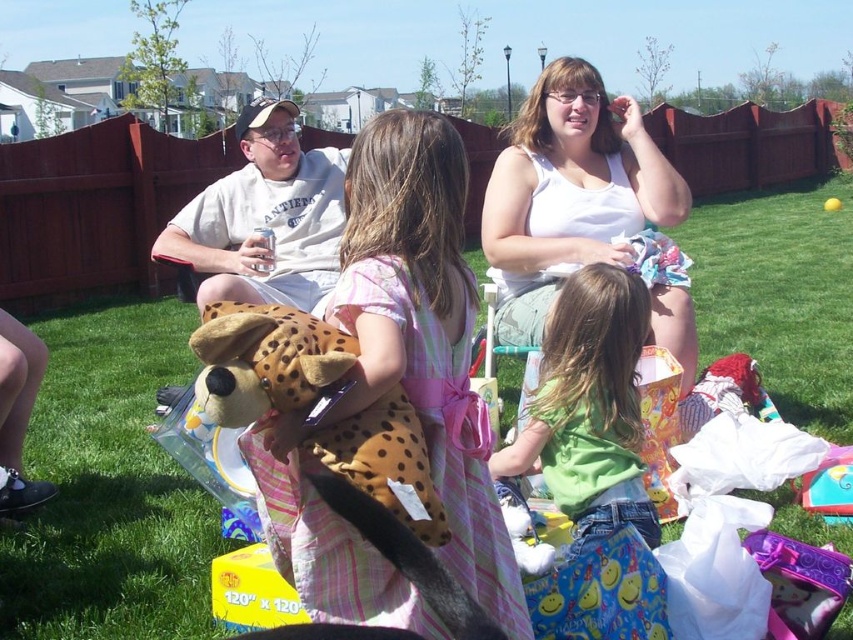
The height and width of the screenshot is (640, 853). What are the coordinates of `soft pink dress at center` in the screenshot? It's located at (424, 332).

Between soft pink dress at center and green cotton shirt at center, which one appears on the right side from the viewer's perspective?

Positioned to the right is green cotton shirt at center.

Between point (364, 576) and point (543, 365), which one is positioned behind?

The point (543, 365) is more distant.

You are a GUI agent. You are given a task and a screenshot of the screen. Output one action in this format:
    pyautogui.click(x=<x>, y=<y>)
    Task: Click on the soft pink dress at center
    Image resolution: width=853 pixels, height=640 pixels.
    Given the screenshot: What is the action you would take?
    pyautogui.click(x=424, y=332)

In order to click on soft pink dress at center in this screenshot , I will do `click(424, 332)`.

Who is more distant from viewer, (350, 326) or (628, 152)?

The point (628, 152) is behind.

Identify the location of soft pink dress at center. (424, 332).

Describe the element at coordinates (582, 208) in the screenshot. This screenshot has height=640, width=853. I see `white cotton tank top at upper center` at that location.

Measure the distance from white cotton tank top at upper center to green cotton shirt at center.

white cotton tank top at upper center and green cotton shirt at center are 26.52 inches apart from each other.

The width and height of the screenshot is (853, 640). Describe the element at coordinates (582, 208) in the screenshot. I see `white cotton tank top at upper center` at that location.

The width and height of the screenshot is (853, 640). I want to click on white cotton tank top at upper center, so click(x=582, y=208).